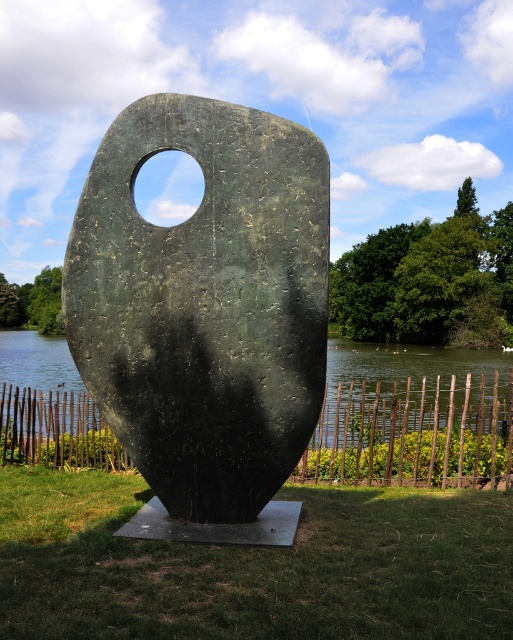
Is bronze textured stone at center further to camera compared to green grass at center?

That is True.

Describe the element at coordinates (205, 310) in the screenshot. I see `bronze textured stone at center` at that location.

In order to click on bronze textured stone at center in this screenshot , I will do `click(205, 310)`.

What do you see at coordinates (205, 310) in the screenshot?
I see `bronze textured stone at center` at bounding box center [205, 310].

Which is in front, point (139, 308) or point (384, 392)?

Point (139, 308) is more forward.

Where is `bronze textured stone at center`? The height and width of the screenshot is (640, 513). bronze textured stone at center is located at coordinates (205, 310).

Is green grass at center to the left of green metallic water at center from the viewer's perspective?

No, green grass at center is not to the left of green metallic water at center.

Which of these two, green grass at center or green metallic water at center, stands taller?

green metallic water at center

This screenshot has width=513, height=640. What are the coordinates of `green grass at center` in the screenshot? It's located at (253, 566).

Where is `green grass at center`? Image resolution: width=513 pixels, height=640 pixels. green grass at center is located at coordinates (253, 566).